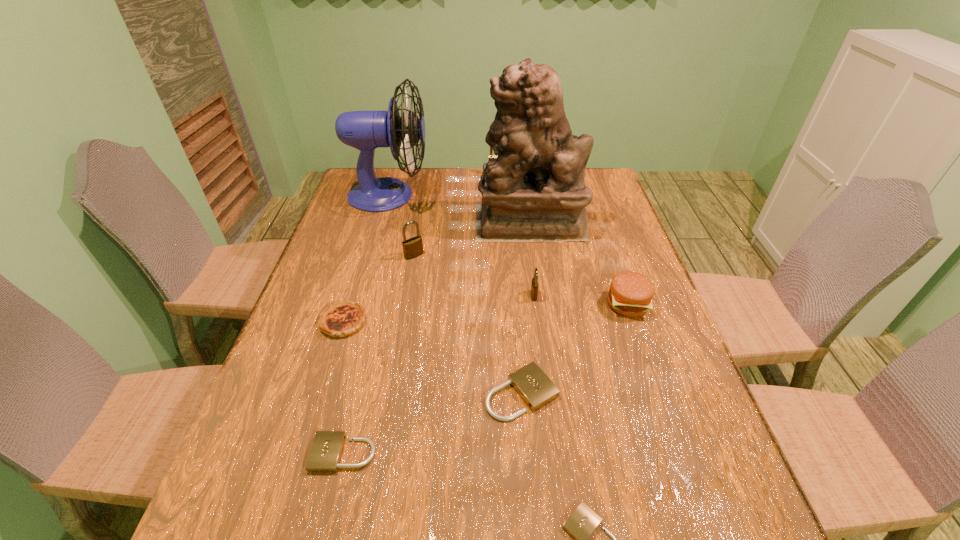
Identify the location of padlock positioned at the left edge. The image size is (960, 540). (326, 450).

Locate an element on the screen. This screenshot has width=960, height=540. sculpture present at the right edge is located at coordinates (535, 190).

Image resolution: width=960 pixels, height=540 pixels. I want to click on hamburger that is at the right edge, so click(630, 294).

Find the location of `object positioned at the far left corner`. object positioned at the far left corner is located at coordinates (364, 130).

Where is `object at the far right corner`? The image size is (960, 540). object at the far right corner is located at coordinates (535, 190).

This screenshot has height=540, width=960. In order to click on vacant space at the far edge of the desktop in this screenshot , I will do `click(453, 194)`.

In the image, there is a desktop. Identify the location of vacant space at the left edge. Image resolution: width=960 pixels, height=540 pixels. [364, 227].

This screenshot has height=540, width=960. In order to click on vacant space at the right edge of the desktop in this screenshot , I will do `click(583, 252)`.

Locate an element on the screen. This screenshot has width=960, height=540. free space between the third tallest padlock and the fifth tallest padlock is located at coordinates (439, 374).

Where is `vacant space in between the leftmost brass padlock and the eighth farthest object`? Image resolution: width=960 pixels, height=540 pixels. vacant space in between the leftmost brass padlock and the eighth farthest object is located at coordinates (468, 324).